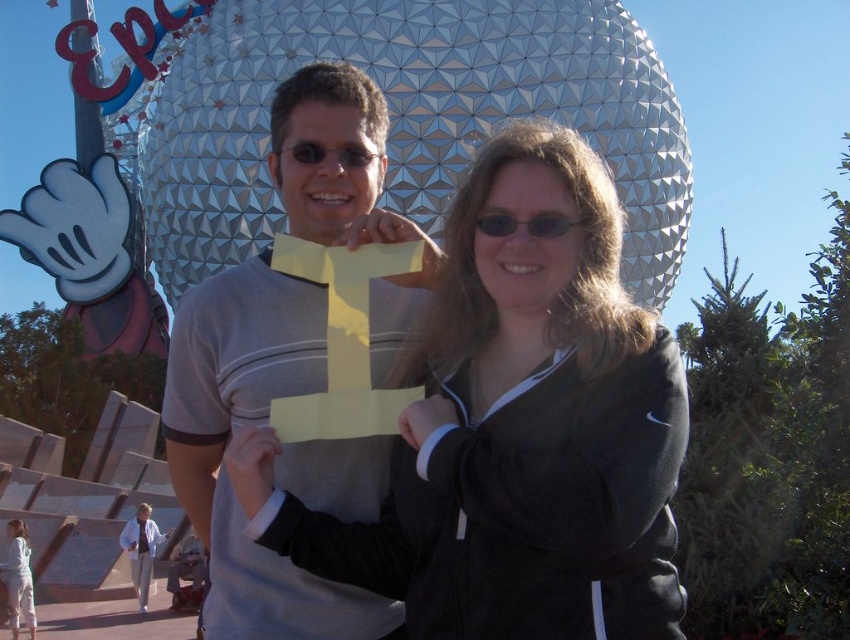
You are a photographer at Epcot and want to take a photo of the black matte jacket at center and the black plastic sunglasses at center. Based on their positions, which object is closer to the camera?

The black matte jacket at center is positioned under the black plastic sunglasses at center, so the sunglasses are closer to the camera.

You are a photographer at Epcot and need to capture a photo where both pairs of sunglasses at the center are clearly visible. Since the black plastic sunglasses at center and matte black sunglasses at center are both in focus, which pair appears narrower?

The black plastic sunglasses at center appears narrower as it has a lesser width compared to the matte black sunglasses at center.